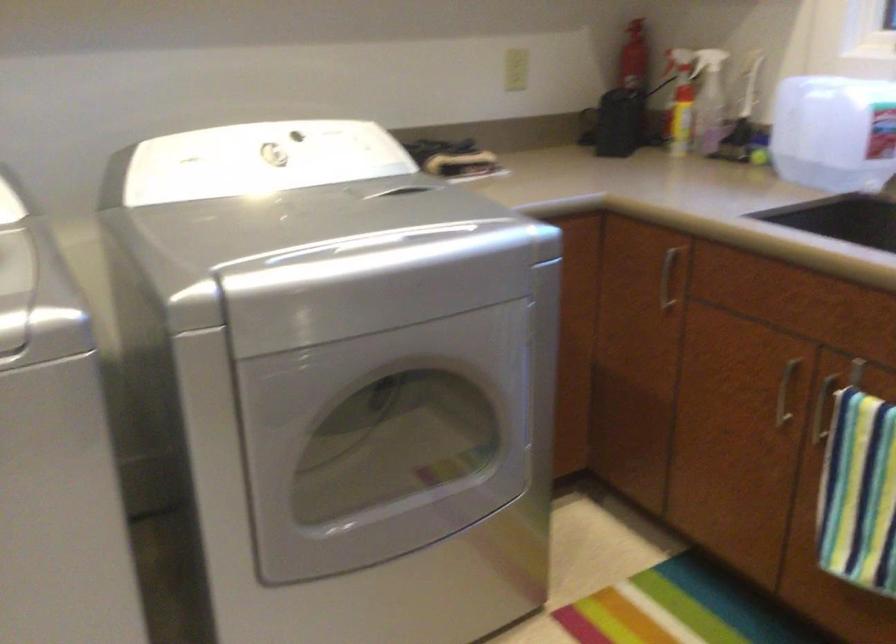
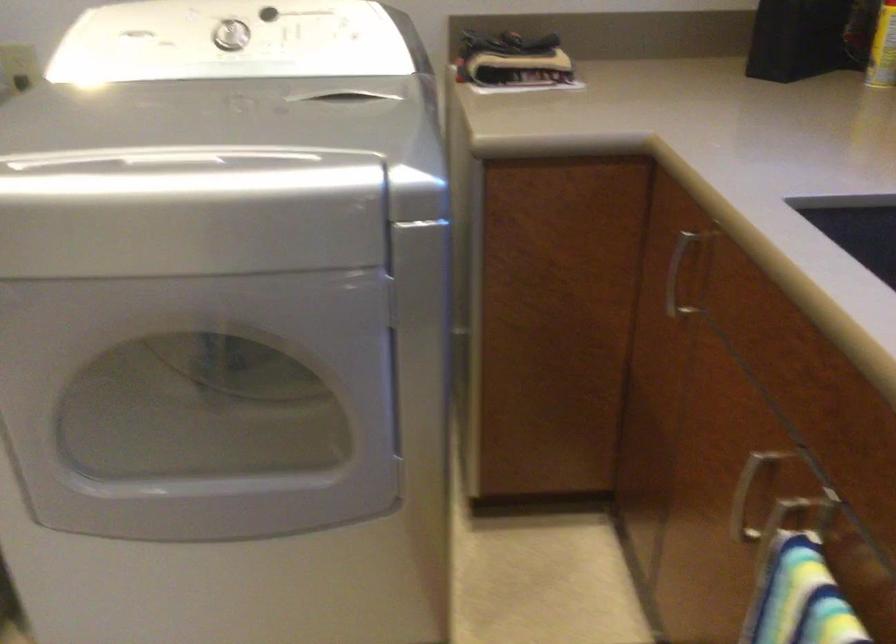
Question: Based on the continuous images, in which direction is the camera rotating? Reply with the corresponding letter.

Choices:
 (A) Left
 (B) Right
 (C) Up
 (D) Down

Answer: (A)